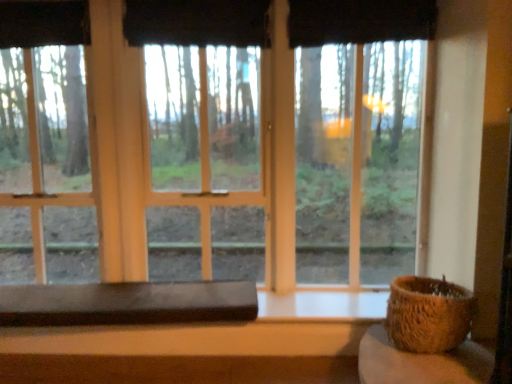
Question: Can you confirm if black fabric curtain at upper center, the second curtain from the right, is wider than transparent glass window at center?

Choices:
 (A) no
 (B) yes

Answer: (A)

Question: From a real-world perspective, is black fabric curtain at upper center, the 1th curtain when ordered from left to right, positioned over transparent glass window at center based on gravity?

Choices:
 (A) yes
 (B) no

Answer: (A)

Question: Considering the relative sizes of black fabric curtain at upper center, the second curtain from the right, and transparent glass window at center in the image provided, is black fabric curtain at upper center, the second curtain from the right, smaller than transparent glass window at center?

Choices:
 (A) no
 (B) yes

Answer: (B)

Question: Is black fabric curtain at upper center, the second curtain from the right, outside transparent glass window at center?

Choices:
 (A) yes
 (B) no

Answer: (B)

Question: Can you see black fabric curtain at upper center, the second curtain from the right, touching transparent glass window at center?

Choices:
 (A) yes
 (B) no

Answer: (B)

Question: Considering the relative sizes of black fabric curtain at upper center, the second curtain from the right, and transparent glass window at center in the image provided, is black fabric curtain at upper center, the second curtain from the right, taller than transparent glass window at center?

Choices:
 (A) no
 (B) yes

Answer: (A)

Question: Is brown woven basket at right positioned before dark brown wood table at lower center, which is the second table from front to back?

Choices:
 (A) no
 (B) yes

Answer: (B)

Question: Is brown woven basket at right wider than dark brown wood table at lower center, the first table positioned from the back?

Choices:
 (A) no
 (B) yes

Answer: (A)

Question: Is brown woven basket at right not within dark brown wood table at lower center, the first table positioned from the back?

Choices:
 (A) yes
 (B) no

Answer: (A)

Question: Does brown woven basket at right have a greater height compared to dark brown wood table at lower center, the first table positioned from the back?

Choices:
 (A) no
 (B) yes

Answer: (B)

Question: Could you tell me if brown woven basket at right is facing dark brown wood table at lower center, which is the second table from front to back?

Choices:
 (A) yes
 (B) no

Answer: (B)

Question: Is brown woven basket at right positioned with its back to dark brown wood table at lower center, the first table viewed from the left?

Choices:
 (A) yes
 (B) no

Answer: (B)

Question: Does brown woven basket at right have a lesser width compared to transparent glass window at center?

Choices:
 (A) yes
 (B) no

Answer: (B)